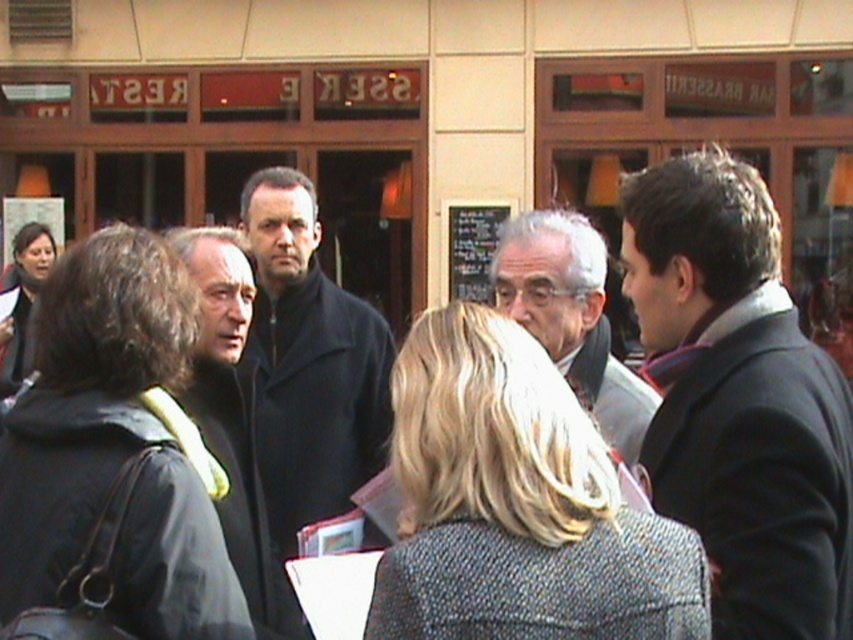
You are standing at point (238, 563) and want to move towards the restaurant entrance. Is the point (248, 192) behind you or in front of you?

The point (248, 192) is behind point (238, 563), so it is behind you.

You are trying to decide between two outerwear options to wear today. You see the dark matte coat at center and the dark brown leather jacket at left in the scene. Which one has a wider silhouette?

The dark matte coat at center has a wider silhouette than the dark brown leather jacket at left.

You are standing at the point marked by the coordinate point [751,284]. The restaurant sign is 2.5 meters tall. Can you see the top of the restaurant sign from your current position?

The point [751,284] is 3.35 meters away from the viewer. Since the restaurant sign is 2.5 meters tall, and the distance is greater than the height, the top of the restaurant sign may not be fully visible from that position depending on the angle and line of sight. However, without additional information about the viewing angle or obstruction, it is impossible to definitively confirm visibility.